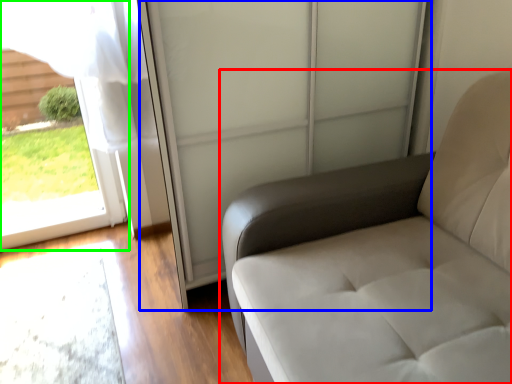
Question: Which is nearer to the furniture (highlighted by a red box)? screen door (highlighted by a blue box) or window (highlighted by a green box).

Choices:
 (A) screen door
 (B) window

Answer: (A)